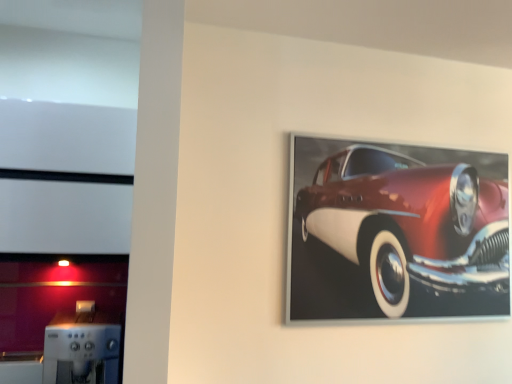
Question: Can you confirm if sleek silver coffee machine at lower left is taller than shiny red car at upper right?

Choices:
 (A) yes
 (B) no

Answer: (B)

Question: From a real-world perspective, is sleek silver coffee machine at lower left located beneath shiny red car at upper right?

Choices:
 (A) no
 (B) yes

Answer: (B)

Question: Does sleek silver coffee machine at lower left come in front of shiny red car at upper right?

Choices:
 (A) no
 (B) yes

Answer: (B)

Question: Would you say sleek silver coffee machine at lower left is outside shiny red car at upper right?

Choices:
 (A) yes
 (B) no

Answer: (A)

Question: From the image's perspective, is sleek silver coffee machine at lower left above shiny red car at upper right?

Choices:
 (A) yes
 (B) no

Answer: (B)

Question: Is sleek silver coffee machine at lower left wider than shiny red car at upper right?

Choices:
 (A) no
 (B) yes

Answer: (B)

Question: Is the position of shiny red car at upper right less distant than that of sleek silver coffee machine at lower left?

Choices:
 (A) yes
 (B) no

Answer: (B)

Question: Is sleek silver coffee machine at lower left at the back of shiny red car at upper right?

Choices:
 (A) yes
 (B) no

Answer: (B)

Question: From the image's perspective, is shiny red car at upper right on sleek silver coffee machine at lower left?

Choices:
 (A) yes
 (B) no

Answer: (A)

Question: Considering the relative positions of shiny red car at upper right and sleek silver coffee machine at lower left in the image provided, is shiny red car at upper right behind sleek silver coffee machine at lower left?

Choices:
 (A) yes
 (B) no

Answer: (A)

Question: Does shiny red car at upper right turn towards sleek silver coffee machine at lower left?

Choices:
 (A) no
 (B) yes

Answer: (A)

Question: Are shiny red car at upper right and sleek silver coffee machine at lower left making contact?

Choices:
 (A) yes
 (B) no

Answer: (B)

Question: Is shiny red car at upper right bigger or smaller than sleek silver coffee machine at lower left?

Choices:
 (A) small
 (B) big

Answer: (B)